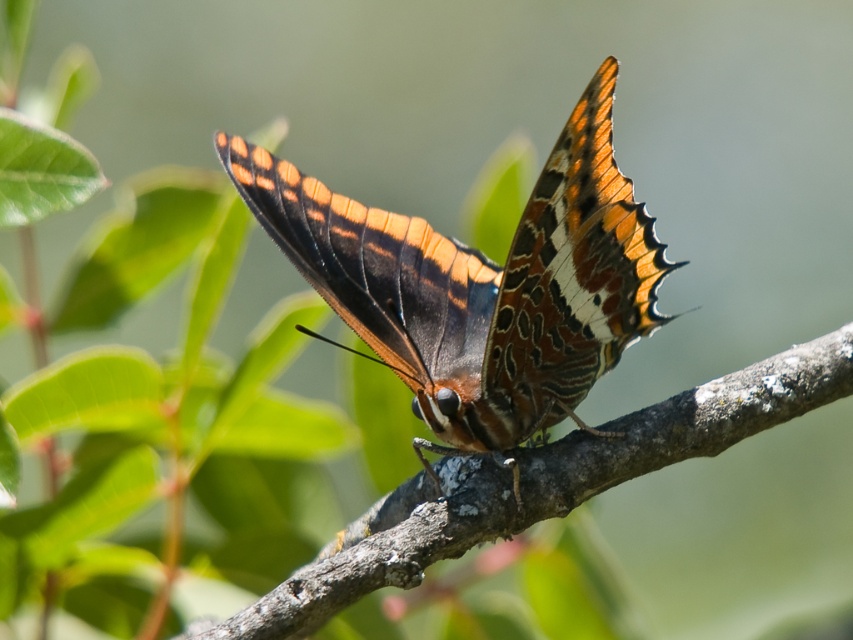
In the scene shown: Does shiny orange butterfly at center have a lesser height compared to brown rough tree branch at center?

No.

Is shiny orange butterfly at center wider than brown rough tree branch at center?

In fact, shiny orange butterfly at center might be narrower than brown rough tree branch at center.

Find the location of `shiny orange butterfly at center`. shiny orange butterfly at center is located at coordinates (480, 285).